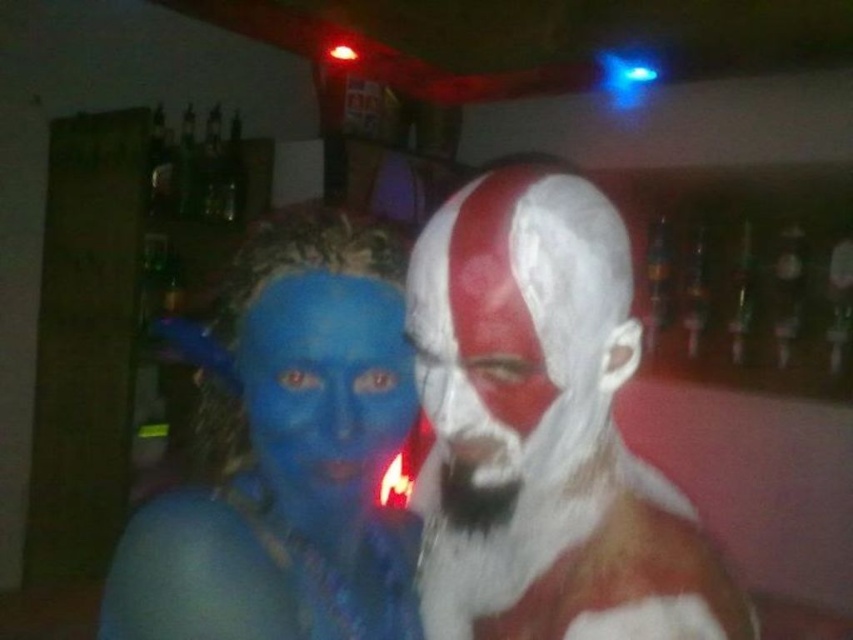
Between white matte face paint at center and white matte beard at center, which one has less height?

white matte beard at center

Can you confirm if white matte face paint at center is taller than white matte beard at center?

Yes.

You are a GUI agent. You are given a task and a screenshot of the screen. Output one action in this format:
    pyautogui.click(x=<x>, y=<y>)
    Task: Click on the white matte face paint at center
    
    Given the screenshot: What is the action you would take?
    pyautogui.click(x=544, y=429)

Who is more distant from viewer, (396, 429) or (465, 360)?

The point (396, 429) is more distant.

Is point (347, 221) farther from camera compared to point (491, 364)?

Yes.

Image resolution: width=853 pixels, height=640 pixels. Find the location of `matte blue face paint at center`. matte blue face paint at center is located at coordinates (287, 454).

Does white matte face paint at center have a greater width compared to blue matte face paint at center?

Yes.

Is point (585, 204) in front of point (312, 476)?

Yes, point (585, 204) is closer to viewer.

Identify the location of white matte face paint at center. The width and height of the screenshot is (853, 640). (544, 429).